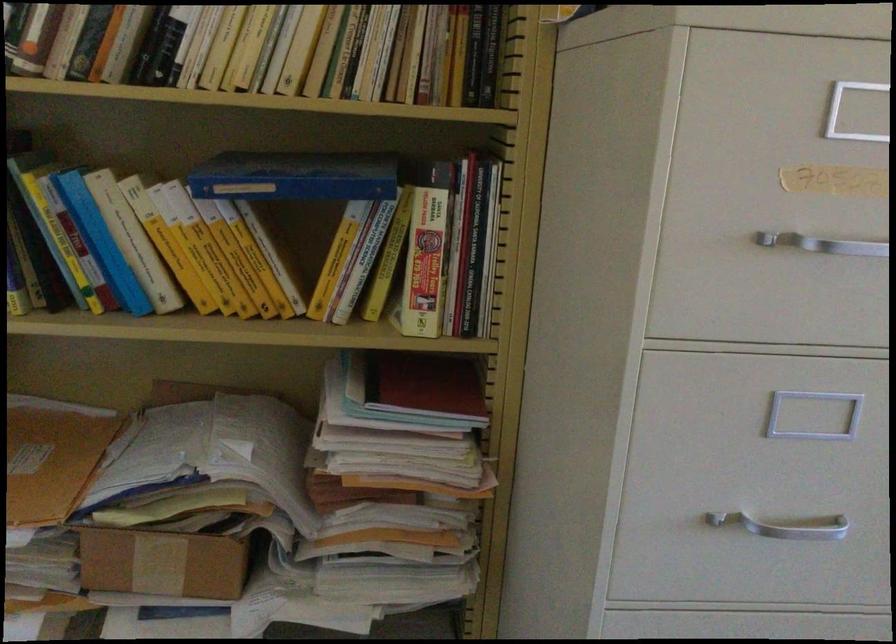
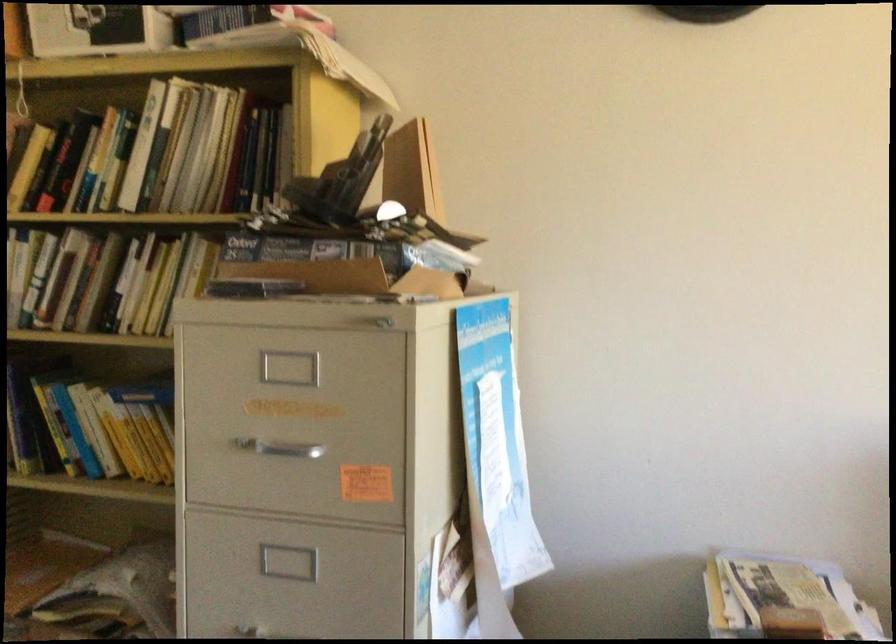
Question: What movement of the cameraman would produce the second image?

Choices:
 (A) Left
 (B) Right
 (C) Forward
 (D) Backward

Answer: (B)